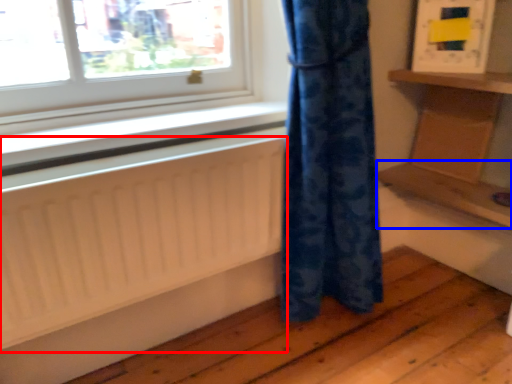
Question: Which of the following is the farthest to the observer, radiator (highlighted by a red box) or shelf (highlighted by a blue box)?

Choices:
 (A) radiator
 (B) shelf

Answer: (B)